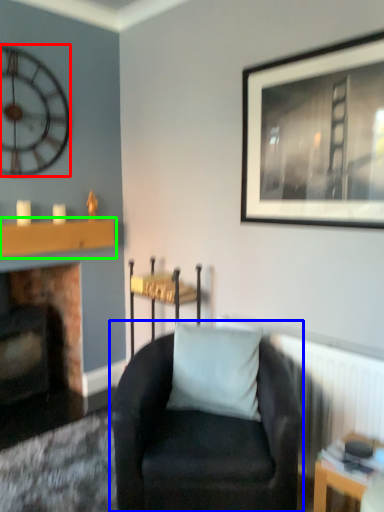
Question: Which object is the farthest from wall clock (highlighted by a red box)? Choose among these: chair (highlighted by a blue box) or mantle (highlighted by a green box).

Choices:
 (A) chair
 (B) mantle

Answer: (A)